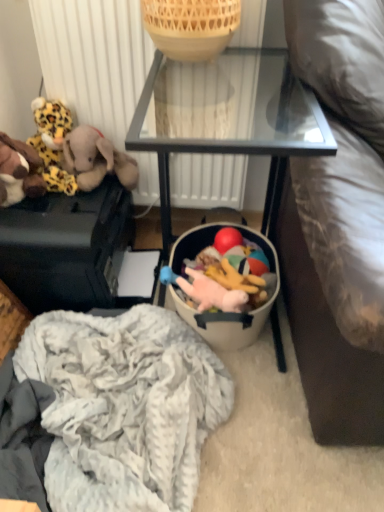
Question: Which is correct: matte black suitcase at left, arranged as the 1th furniture when viewed from the left, is inside bamboo basket at upper center, or outside of it?

Choices:
 (A) inside
 (B) outside

Answer: (B)

Question: Does point (69, 197) appear closer or farther from the camera than point (152, 22)?

Choices:
 (A) closer
 (B) farther

Answer: (B)

Question: Which object is the farthest from the rubber ball at center, the 5th toy positioned from the left?

Choices:
 (A) pink plush toy at lower center, arranged as the second toy when viewed from the right
 (B) bamboo basket at upper center
 (C) brown plush toy at left, which ranks as the 5th toy in right-to-left order
 (D) brown plush elephant at left, acting as the third toy starting from the right
 (E) white textured radiator at upper center

Answer: (C)

Question: Estimate the real-world distances between objects in this image. Which object is closer to the leopard print plush at left, the second toy viewed from the left?

Choices:
 (A) brown plush elephant at left, acting as the third toy starting from the right
 (B) bamboo basket at upper center
 (C) white textured radiator at upper center
 (D) white fluffy blanket at lower center
 (E) black glass table at center, which appears as the 1th furniture when viewed from the right

Answer: (A)